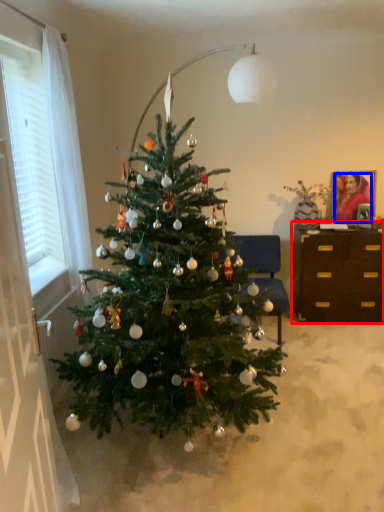
Question: Which of the following is the closest to the observer, desk (highlighted by a red box) or person (highlighted by a blue box)?

Choices:
 (A) desk
 (B) person

Answer: (A)